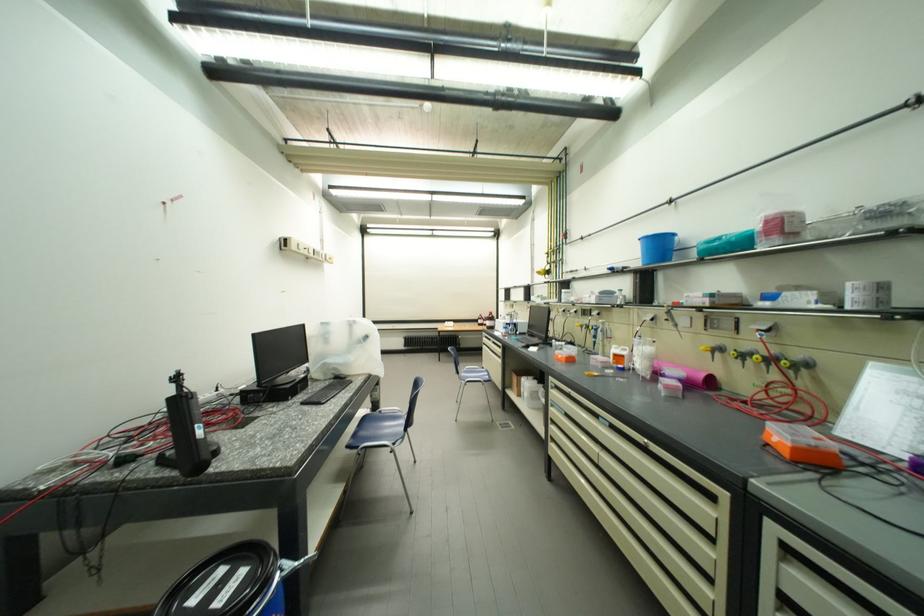
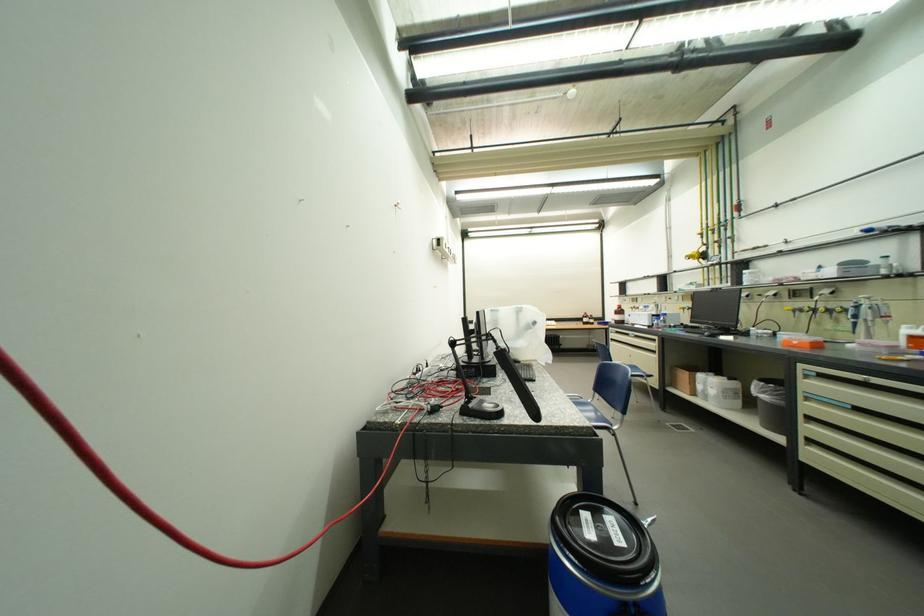
Find the pixel in the second image that matches point (193, 403) in the first image.

(517, 358)